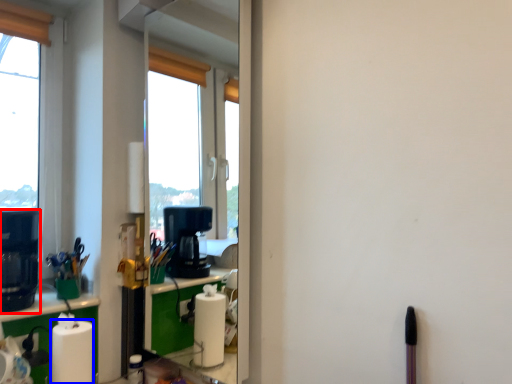
Question: Which object appears farthest to the camera in this image, coffee machine (highlighted by a red box) or paper towel (highlighted by a blue box)?

Choices:
 (A) coffee machine
 (B) paper towel

Answer: (A)